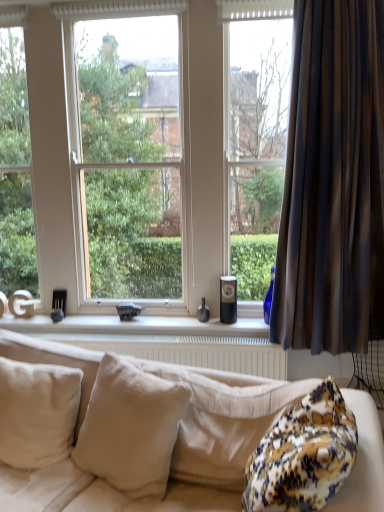
Identify the location of empty space that is ontop of white matte window sill at center (from a real-world perspective). Image resolution: width=384 pixels, height=512 pixels. (119, 321).